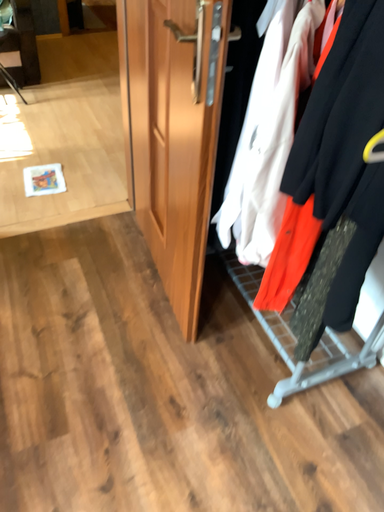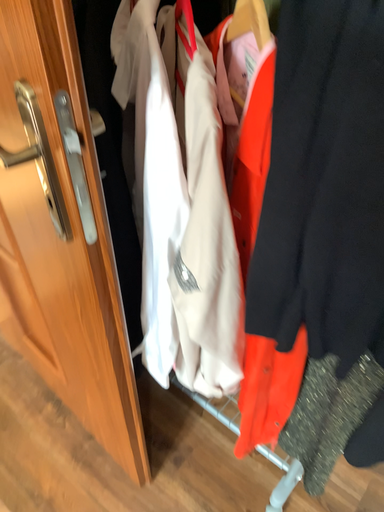
Question: How did the camera likely rotate when shooting the video?

Choices:
 (A) rotated right
 (B) rotated left

Answer: (A)